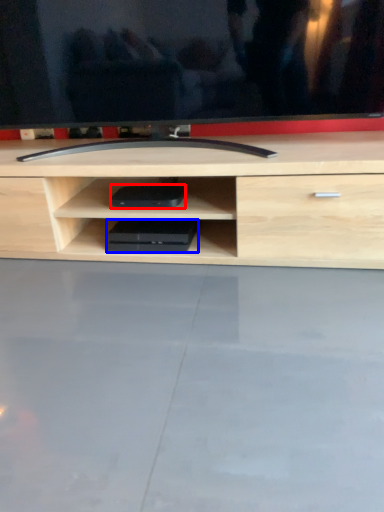
Question: Among these objects, which one is farthest to the camera, equipment (highlighted by a red box) or equipment (highlighted by a blue box)?

Choices:
 (A) equipment
 (B) equipment

Answer: (B)